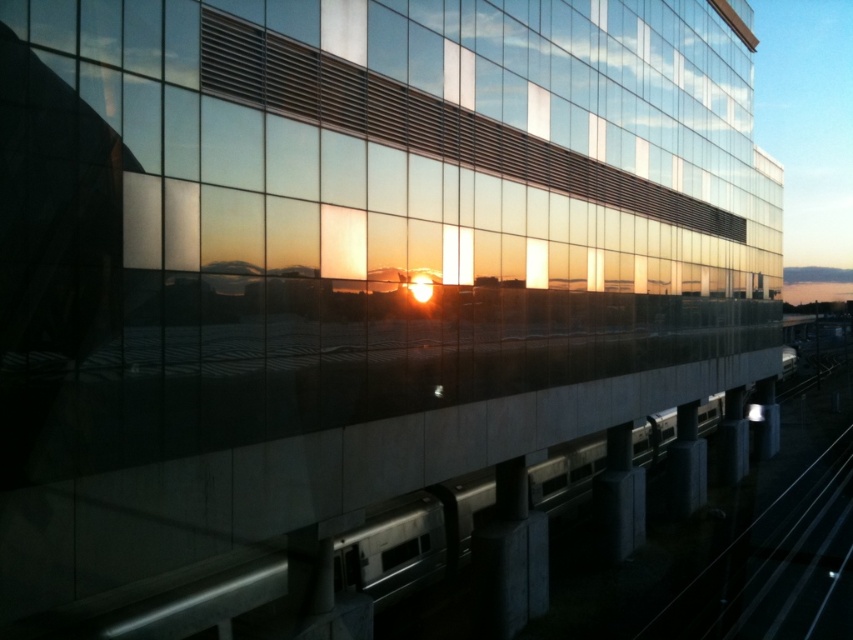
Consider the image. You are a passenger waiting at the train station platform. You see the black metal train track at lower right and the silver metallic train at center. Which object is taller from your perspective?

The silver metallic train at center is taller than the black metal train track at lower right.

You are standing at the entrance of the building and want to walk to the black metal train track at lower right. What are the coordinates of the direction you should walk towards?

The coordinates of the black metal train track at lower right are at point (778, 566), so you should walk towards that direction.